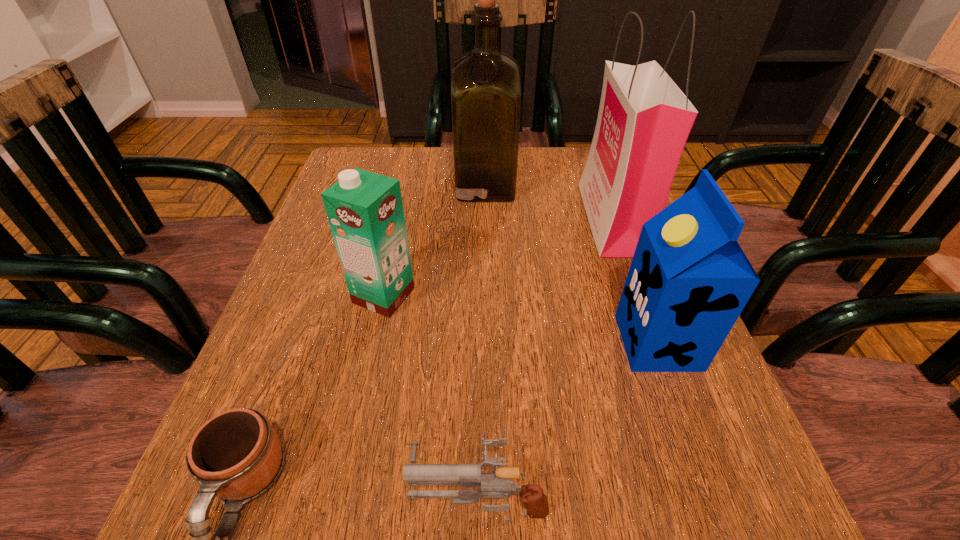
You are a GUI agent. You are given a task and a screenshot of the screen. Output one action in this format:
    pyautogui.click(x=<x>, y=<y>)
    Task: Click on the vacant space situated 0.290m on the label of the liquor
    
    Given the screenshot: What is the action you would take?
    pyautogui.click(x=339, y=185)

This screenshot has height=540, width=960. Identify the location of vacant space located 0.060m with the cap open on the right carton. (586, 342).

Identify the location of vacant space situated with the cap open on the right carton. Image resolution: width=960 pixels, height=540 pixels. (527, 342).

Where is `vacant space situated 0.270m with the cap open on the right carton`? The width and height of the screenshot is (960, 540). vacant space situated 0.270m with the cap open on the right carton is located at coordinates (461, 342).

Locate an element on the screen. The height and width of the screenshot is (540, 960). free space located 0.200m on the right of the shorter carton is located at coordinates (521, 295).

Image resolution: width=960 pixels, height=540 pixels. In order to click on shopping bag present at the far edge in this screenshot , I will do `click(644, 119)`.

The height and width of the screenshot is (540, 960). Find the location of `liquor present at the far edge`. liquor present at the far edge is located at coordinates (486, 95).

You are a GUI agent. You are given a task and a screenshot of the screen. Output one action in this format:
    pyautogui.click(x=<x>, y=<y>)
    Task: Click on the object at the left edge
    The width and height of the screenshot is (960, 540).
    Given the screenshot: What is the action you would take?
    pyautogui.click(x=365, y=211)

The width and height of the screenshot is (960, 540). Identify the location of shopping bag present at the right edge. (644, 119).

You are a GUI agent. You are given a task and a screenshot of the screen. Output one action in this format:
    pyautogui.click(x=<x>, y=<y>)
    Task: Click on the carton present at the right edge
    Image resolution: width=960 pixels, height=540 pixels.
    Given the screenshot: What is the action you would take?
    pyautogui.click(x=689, y=280)